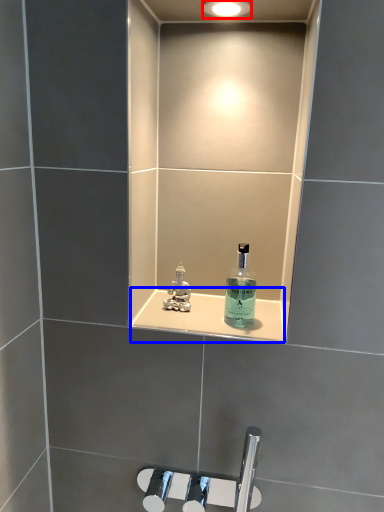
Question: Among these objects, which one is nearest to the camera, light fixture (highlighted by a red box) or ledge (highlighted by a blue box)?

Choices:
 (A) light fixture
 (B) ledge

Answer: (A)